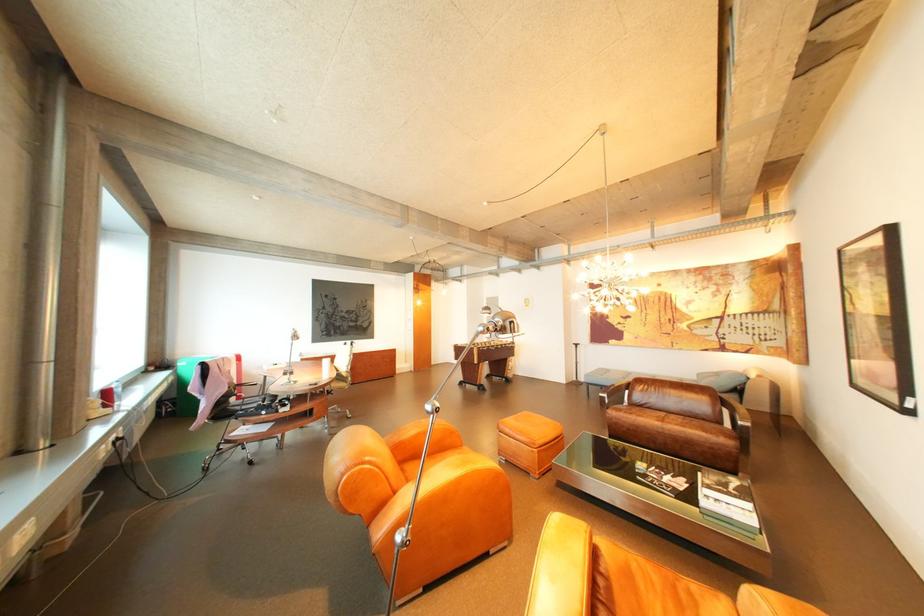
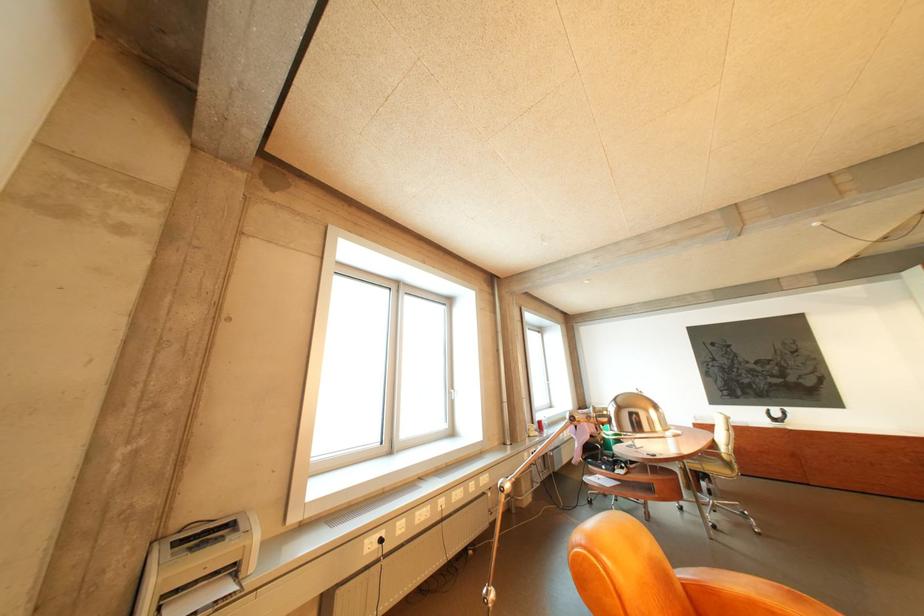
Locate, in the second image, the point that corresponds to the point at 524,323 in the first image.

(643, 415)